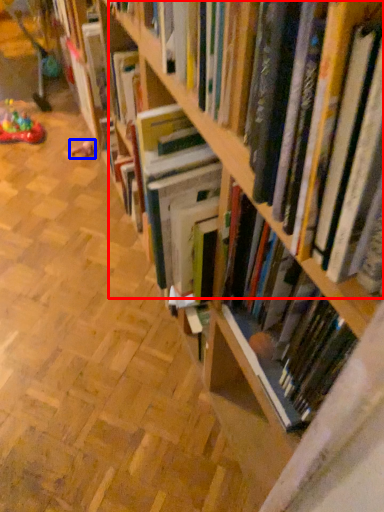
Question: Which of the following is the closest to the observer, book (highlighted by a red box) or toy (highlighted by a blue box)?

Choices:
 (A) book
 (B) toy

Answer: (A)